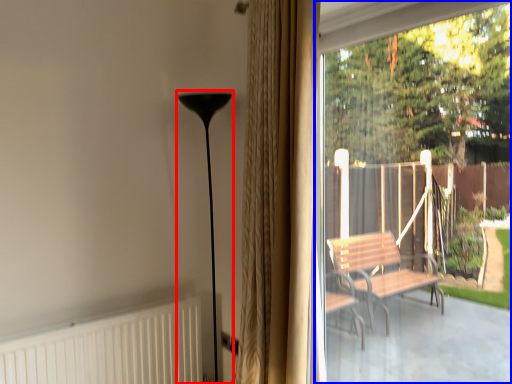
Question: Which point is closer to the camera, lamp (highlighted by a red box) or window screen (highlighted by a blue box)?

Choices:
 (A) lamp
 (B) window screen

Answer: (B)